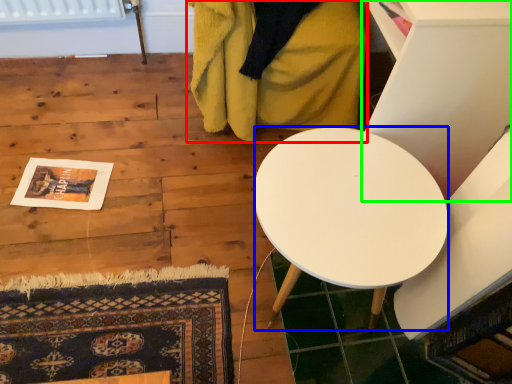
Question: Considering the real-world distances, which object is farthest from blanket (highlighted by a red box)? desk (highlighted by a blue box) or furniture (highlighted by a green box)?

Choices:
 (A) desk
 (B) furniture

Answer: (A)